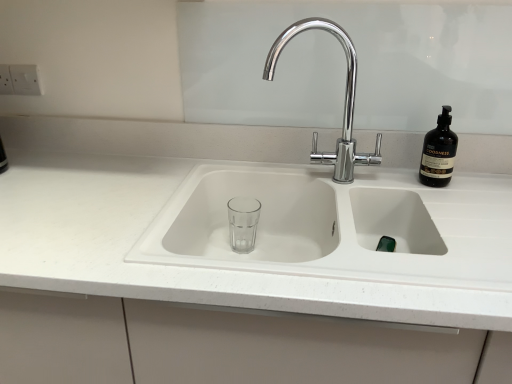
At what (x,y) coordinates should I click in order to perform the action: click on free spot to the right of chrome/metallic faucet at center. Please return your answer as a coordinate pair (x, y). The width and height of the screenshot is (512, 384). Looking at the image, I should click on (418, 188).